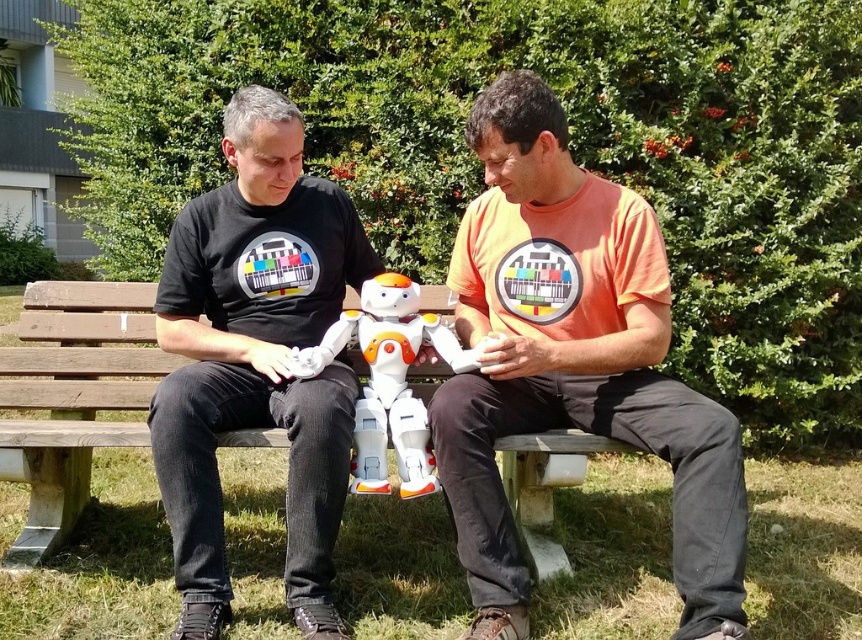
You are a photographer planning to take a portrait of the black matte shirt at left and the wooden bench at center. Based on their positions, which object should you focus on first to ensure proper depth of field?

The black matte shirt at left is located above the wooden bench at center, so you should focus on the wooden bench at center first to ensure proper depth of field since it is closer to the camera.

You are standing in the park and see two points marked in the image. Which point, point (298, 138) or point (397, 308), is closer to you?

Point (298, 138) is closer to the viewer than point (397, 308).